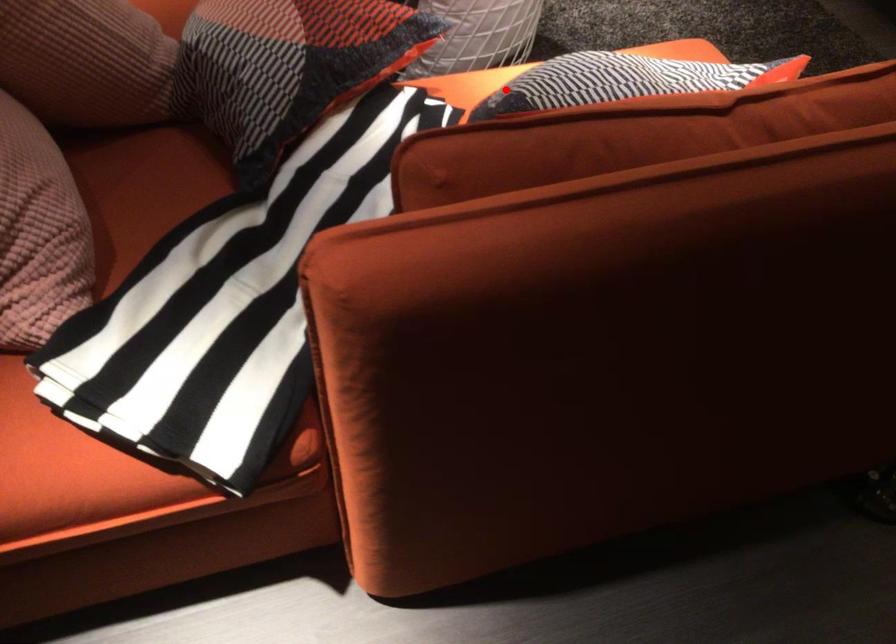
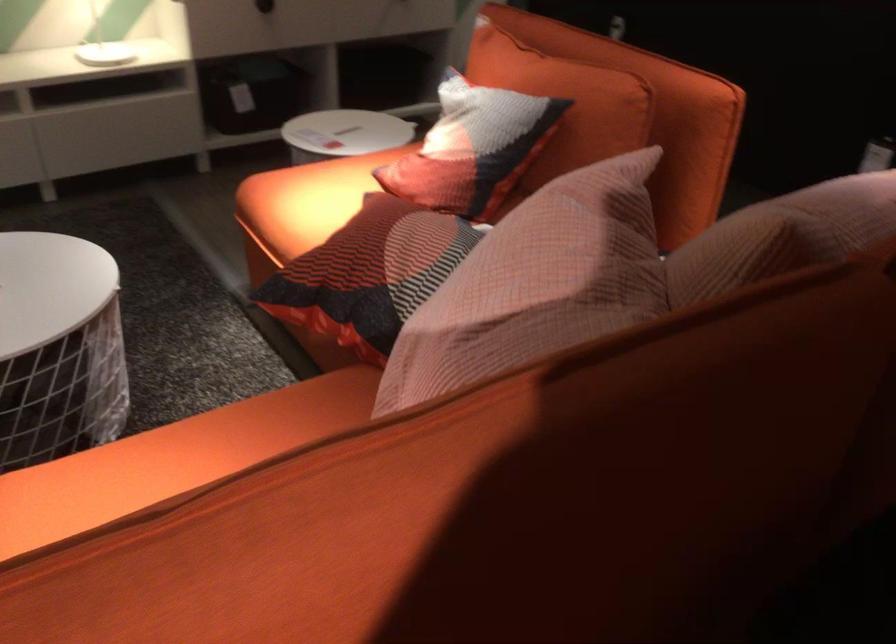
Question: I am providing you with two images of the same scene from different viewpoints. A red point is shown in image1. For the corresponding object point in image2, is it positioned nearer or farther from the camera?

Choices:
 (A) Nearer
 (B) Farther

Answer: (B)